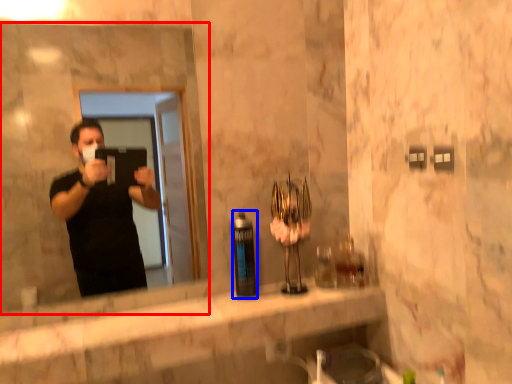
Question: Which point is further to the camera, mirror (highlighted by a red box) or bottle (highlighted by a blue box)?

Choices:
 (A) mirror
 (B) bottle

Answer: (B)